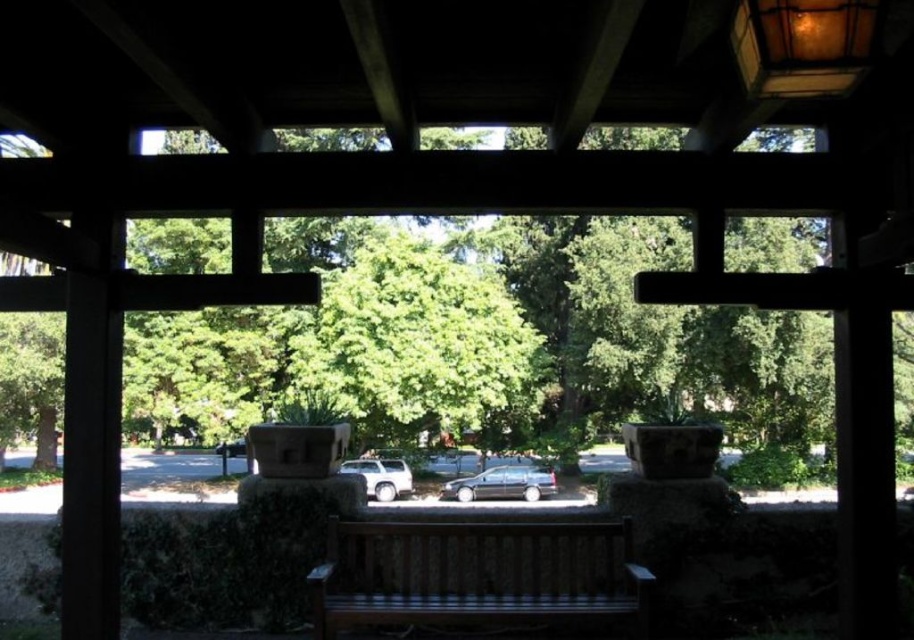
You are sitting on the wooden bench at center and want to look at the green leafy tree at center. Which object is closer to your eyes?

The wooden bench at center is closer to your eyes because it is positioned in front of the green leafy tree at center, which is further away.

You are standing at the point marked by the coordinates point (476, 573) in the image. What object are you standing on?

You are standing on the wooden bench at center.